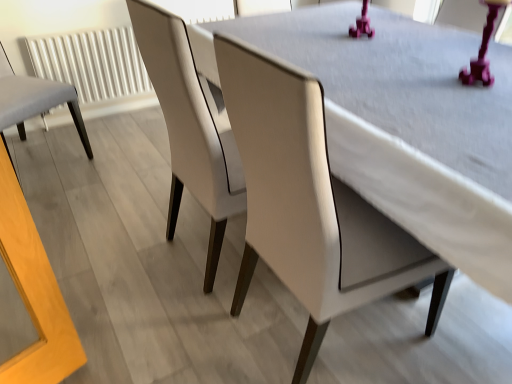
Locate an element on the screen. The height and width of the screenshot is (384, 512). vacant region below white textured radiator at left (from a real-world perspective) is located at coordinates (119, 112).